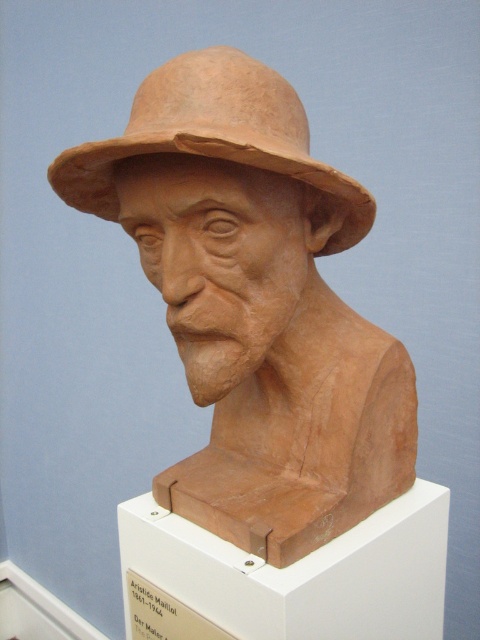
Question: Considering the relative positions of matte clay bust at center and matte clay cowboy hat at center in the image provided, where is matte clay bust at center located with respect to matte clay cowboy hat at center?

Choices:
 (A) left
 (B) right

Answer: (B)

Question: Is matte clay bust at center wider than matte clay cowboy hat at center?

Choices:
 (A) yes
 (B) no

Answer: (A)

Question: Which object is farther from the camera taking this photo?

Choices:
 (A) matte clay bust at center
 (B) matte clay cowboy hat at center

Answer: (A)

Question: Does matte clay bust at center have a lesser width compared to matte clay cowboy hat at center?

Choices:
 (A) yes
 (B) no

Answer: (B)

Question: Which object appears closest to the camera in this image?

Choices:
 (A) matte clay bust at center
 (B) matte clay cowboy hat at center

Answer: (B)